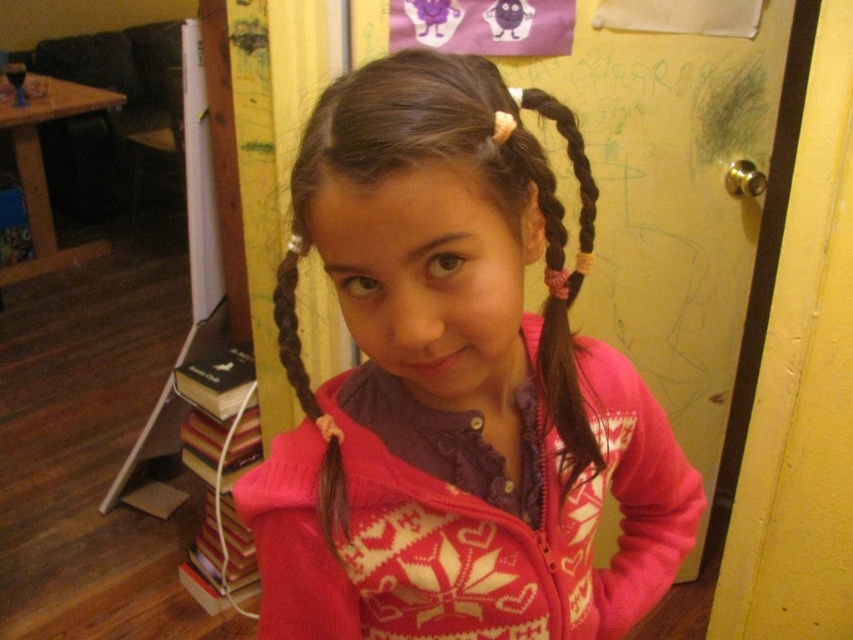
The girl is wearing a pink sweater at center and has brown braided hair at left. Which of these items takes up more space visually?

The pink sweater at center takes up more space visually because it has a larger size compared to the brown braided hair at left.

The girl is wearing a pink sweater at center and has brown silky hair at center. How far apart are these two features on her?

The pink sweater at center and brown silky hair at center are 3.47 inches apart.